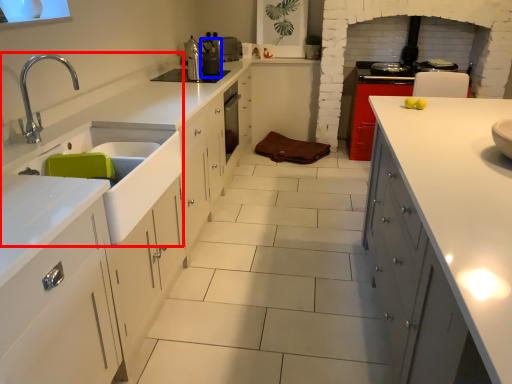
Question: Which object is closer to the camera taking this photo, sink (highlighted by a red box) or appliance (highlighted by a blue box)?

Choices:
 (A) sink
 (B) appliance

Answer: (A)